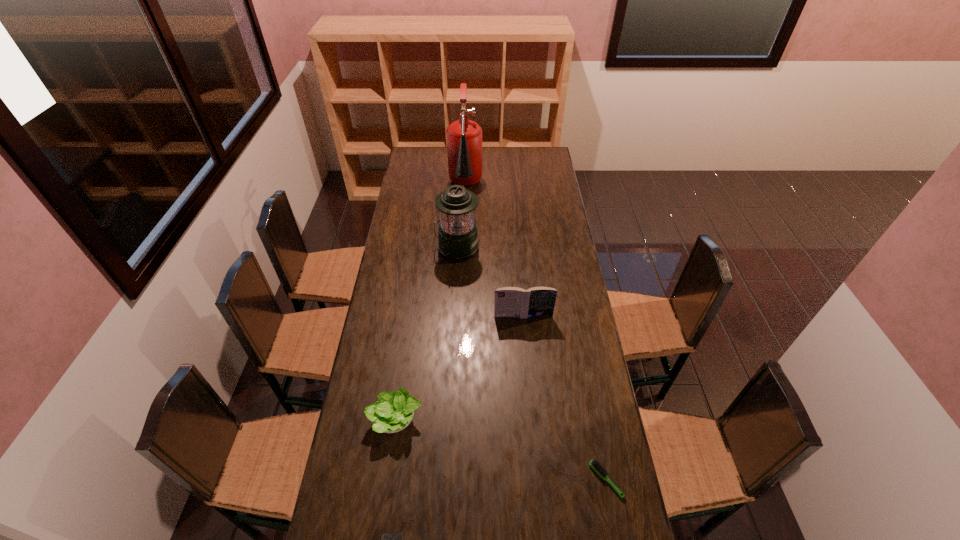
Identify the location of free region that satisfies the following two spatial constraints: 1. with the nozzle aimed from the tallest object; 2. on the right side of the fifth farthest object. Image resolution: width=960 pixels, height=540 pixels. (453, 480).

Where is `free location that satisfies the following two spatial constraints: 1. on the front cover of the rightmost object; 2. on the right side of the third farthest object`? The image size is (960, 540). free location that satisfies the following two spatial constraints: 1. on the front cover of the rightmost object; 2. on the right side of the third farthest object is located at coordinates (538, 480).